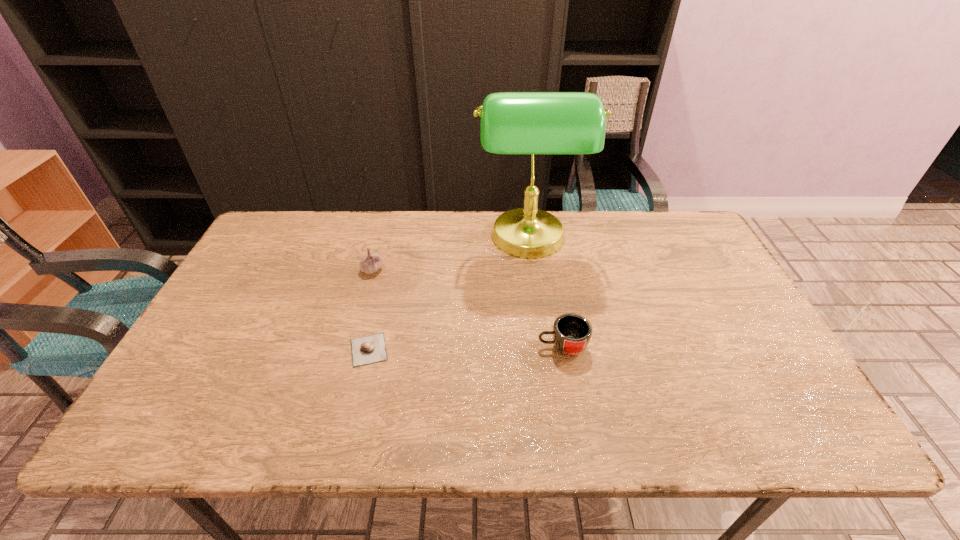
At what (x,y) coordinates should I click in order to perform the action: click on object that is the second closest to the mug. Please return your answer as a coordinate pair (x, y). The width and height of the screenshot is (960, 540). Looking at the image, I should click on click(x=369, y=349).

Where is `free space in the image that satisfies the following two spatial constraints: 1. on the front side of the taller garlic; 2. on the left side of the shortest object`? The height and width of the screenshot is (540, 960). free space in the image that satisfies the following two spatial constraints: 1. on the front side of the taller garlic; 2. on the left side of the shortest object is located at coordinates (351, 349).